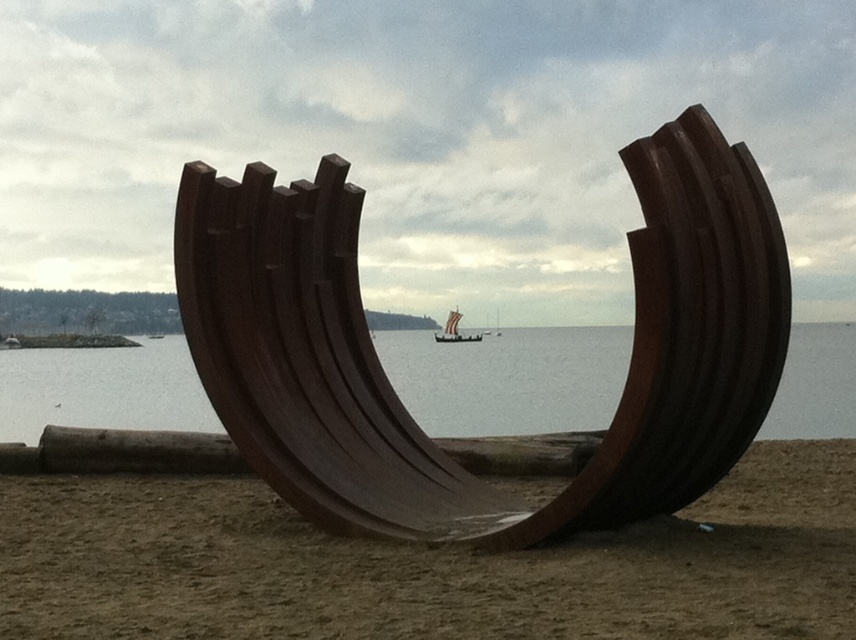
You are standing on the beach looking at the two sculptures. Which sculpture would appear larger to you, the rusty metal sculpture at center or the rustic wood sculpture at center?

The rusty metal sculpture at center appears larger because it is closer to the viewer than the rustic wood sculpture at center.

You are an artist planning to create a miniature version of the scene. You have limited materials and need to prioritize the size of the rustic wood sculpture at center and the brown wooden water at center. Which object should you make smaller to conserve materials?

The rustic wood sculpture at center has a smaller size compared to the brown wooden water at center, so you should make the rustic wood sculpture at center smaller to conserve materials.